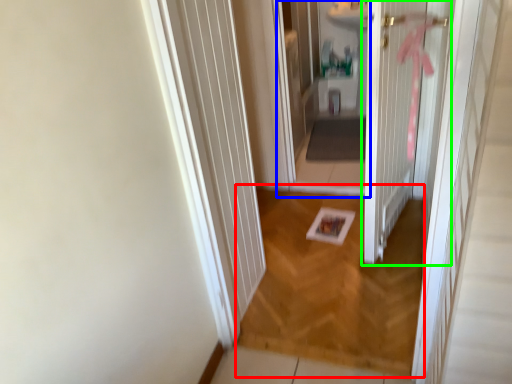
Question: Which is farther away from plain (highlighted by a red box)? corridor (highlighted by a blue box) or door (highlighted by a green box)?

Choices:
 (A) corridor
 (B) door

Answer: (A)